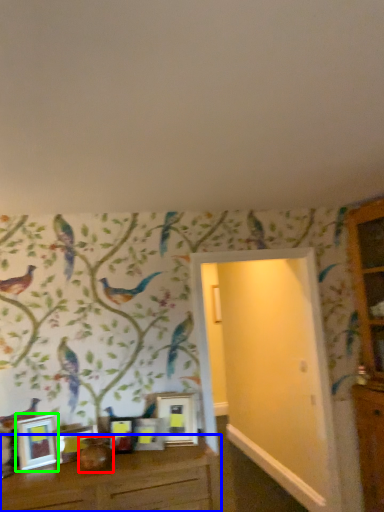
Question: Based on their relative distances, which object is farther from vase (highlighted by a red box)? Choose from table (highlighted by a blue box) and picture frame (highlighted by a green box).

Choices:
 (A) table
 (B) picture frame

Answer: (B)